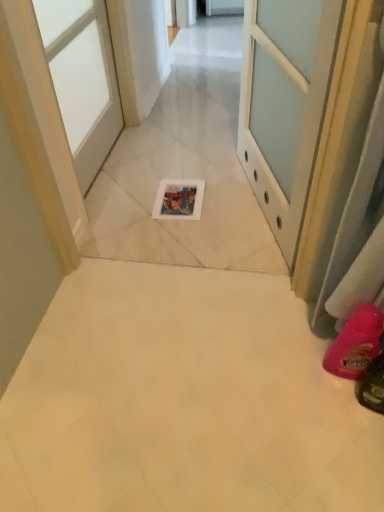
Find the location of a particular element. Image resolution: width=384 pixels, height=512 pixels. vacant space situated on the left part of white glossy door at upper center, which appears as the 2th door when viewed from the left is located at coordinates (183, 204).